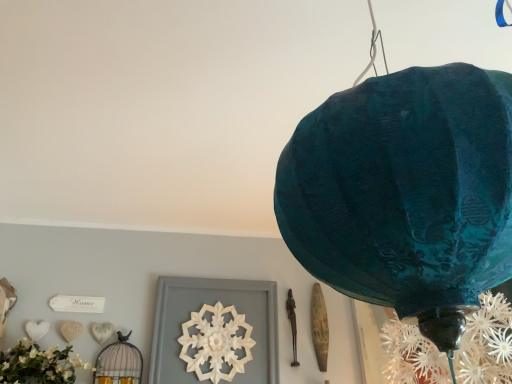
Question: Is matte black birdcage at lower left at the back of teal paper lantern at upper right?

Choices:
 (A) yes
 (B) no

Answer: (B)

Question: Is teal paper lantern at upper right bigger than matte black birdcage at lower left?

Choices:
 (A) yes
 (B) no

Answer: (A)

Question: Could you tell me if teal paper lantern at upper right is turned towards matte black birdcage at lower left?

Choices:
 (A) no
 (B) yes

Answer: (A)

Question: Would you consider teal paper lantern at upper right to be distant from matte black birdcage at lower left?

Choices:
 (A) yes
 (B) no

Answer: (A)

Question: Is teal paper lantern at upper right not inside matte black birdcage at lower left?

Choices:
 (A) yes
 (B) no

Answer: (A)

Question: Looking at the image, does teal paper lantern at upper right seem bigger or smaller compared to matte black birdcage at lower left?

Choices:
 (A) small
 (B) big

Answer: (B)

Question: Considering their positions, is teal paper lantern at upper right located in front of or behind matte black birdcage at lower left?

Choices:
 (A) front
 (B) behind

Answer: (A)

Question: Visually, is teal paper lantern at upper right positioned to the left or to the right of matte black birdcage at lower left?

Choices:
 (A) right
 (B) left

Answer: (A)

Question: Considering the positions of teal paper lantern at upper right and matte black birdcage at lower left in the image, is teal paper lantern at upper right wider or thinner than matte black birdcage at lower left?

Choices:
 (A) thin
 (B) wide

Answer: (B)

Question: From the image's perspective, is matte black birdcage at lower left above or below white carved wood at center?

Choices:
 (A) below
 (B) above

Answer: (A)

Question: In terms of height, does matte black birdcage at lower left look taller or shorter compared to white carved wood at center?

Choices:
 (A) short
 (B) tall

Answer: (A)

Question: Choose the correct answer: Is matte black birdcage at lower left inside white carved wood at center or outside it?

Choices:
 (A) inside
 (B) outside

Answer: (B)

Question: Is matte black birdcage at lower left wider or thinner than white carved wood at center?

Choices:
 (A) wide
 (B) thin

Answer: (A)

Question: Is matte black birdcage at lower left taller or shorter than teal paper lantern at upper right?

Choices:
 (A) short
 (B) tall

Answer: (A)

Question: Based on their sizes in the image, would you say matte black birdcage at lower left is bigger or smaller than teal paper lantern at upper right?

Choices:
 (A) small
 (B) big

Answer: (A)